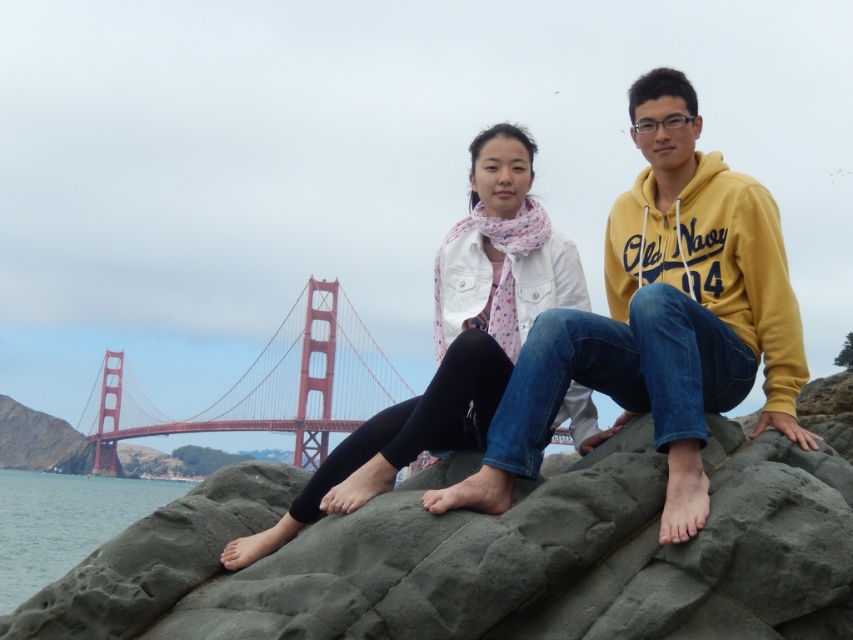
Question: Which point is farther to the camera?

Choices:
 (A) (42, 516)
 (B) (198, 417)
 (C) (645, 595)

Answer: (B)

Question: Which is farther from the gray rough rock at center?

Choices:
 (A) clear water at lower left
 (B) matte yellow hoodie at center
 (C) red painted steel bridge at center

Answer: (C)

Question: Can you confirm if gray rough rock at center is positioned above matte yellow hoodie at center?

Choices:
 (A) yes
 (B) no

Answer: (B)

Question: Can you confirm if matte yellow hoodie at center is thinner than red painted steel bridge at center?

Choices:
 (A) yes
 (B) no

Answer: (A)

Question: Which of the following is the closest to the observer?

Choices:
 (A) (108, 456)
 (B) (824, 577)
 (C) (529, 360)
 (D) (45, 499)

Answer: (B)

Question: Is gray rough rock at center closer to the viewer compared to red painted steel bridge at center?

Choices:
 (A) yes
 (B) no

Answer: (A)